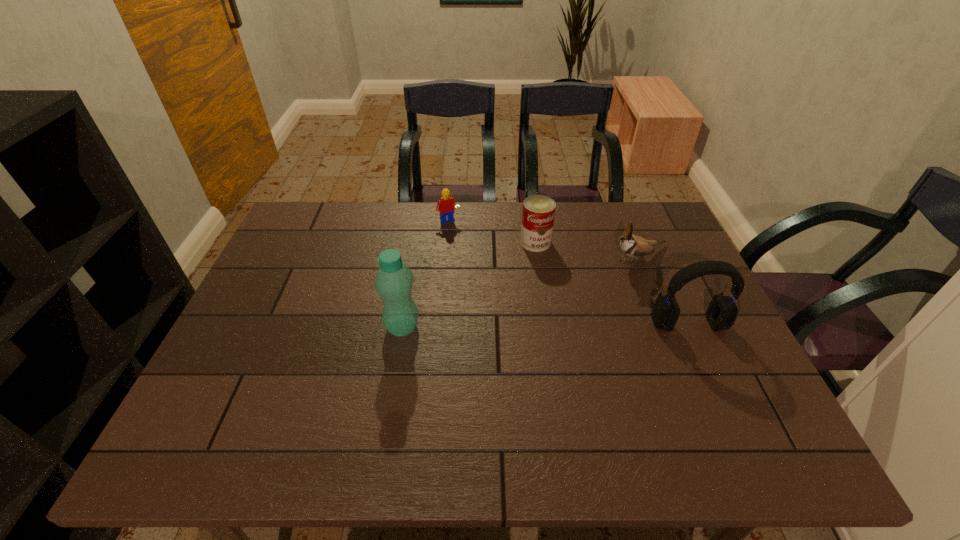
This screenshot has width=960, height=540. What are the coordinates of `free spot located 0.050m at the face of the bird` in the screenshot? It's located at (601, 272).

Locate an element on the screen. The image size is (960, 540). vacant space situated at the face of the bird is located at coordinates (557, 295).

Identify the location of vacant space positioned on the front label of the fourth tallest object. Image resolution: width=960 pixels, height=540 pixels. (540, 262).

At what (x,y) coordinates should I click in order to perform the action: click on free location located on the front label of the fourth tallest object. Please return your answer as a coordinate pair (x, y). Looking at the image, I should click on (561, 352).

At what (x,y) coordinates should I click in order to perform the action: click on blank area located on the front label of the fourth tallest object. Please return your answer as a coordinate pair (x, y). This screenshot has height=540, width=960. Looking at the image, I should click on (561, 352).

You are a GUI agent. You are given a task and a screenshot of the screen. Output one action in this format:
    pyautogui.click(x=<x>, y=<y>)
    Task: Click on the blank area located on the front-facing side of the farthest object
    The width and height of the screenshot is (960, 540).
    Given the screenshot: What is the action you would take?
    pyautogui.click(x=483, y=266)

At what (x,y) coordinates should I click in order to perform the action: click on free space located on the front-facing side of the farthest object. Please return your answer as a coordinate pair (x, y). The width and height of the screenshot is (960, 540). Looking at the image, I should click on (495, 283).

In order to click on vacant position located on the front-facing side of the farthest object in this screenshot , I will do `click(493, 281)`.

At what (x,y) coordinates should I click in order to perform the action: click on bird that is at the far edge. Please return your answer as a coordinate pair (x, y). The width and height of the screenshot is (960, 540). Looking at the image, I should click on (631, 245).

I want to click on can that is at the far edge, so click(x=538, y=214).